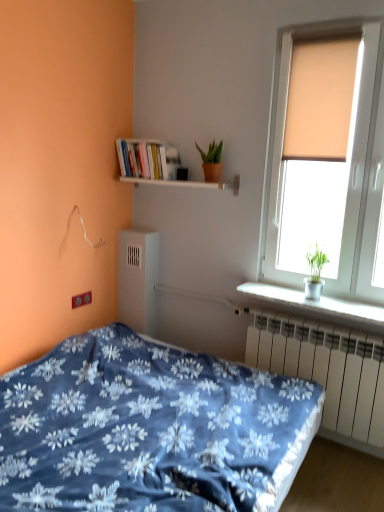
Image resolution: width=384 pixels, height=512 pixels. Identify the location of free space above matte beige window at upper right (from a real-world perspective). (342, 15).